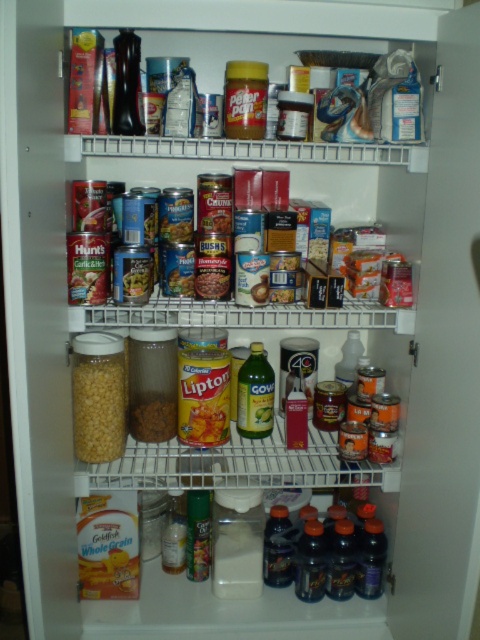
You are organizing the pantry and need to place a new item at coordinates 0.6, 0.2. Is there space available at that location on the shelf where the yellow matte corn at center is located?

The yellow matte corn at center is located at coordinates (97, 406). The new item at (96, 384) is very close but slightly offset. Since the pantry items are arranged somewhat haphazardly but still in order, there might be limited space. However, the exact availability isn

You are organizing the pantry and want to place a new item between the yellow matte lipton tea at center and the green matte can at center. The new item is 6 inches wide. Can it fit in the space between them?

The space between the yellow matte lipton tea at center and the green matte can at center is 12.38 inches. Since the new item is 6 inches wide, it can fit in the space between them as 6 inches is less than 12.38 inches.